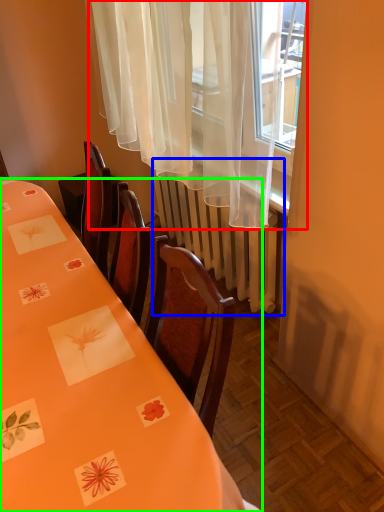
Question: Which object is the farthest from curtain (highlighted by a red box)? Choose among these: radiator (highlighted by a blue box) or table (highlighted by a green box).

Choices:
 (A) radiator
 (B) table

Answer: (B)